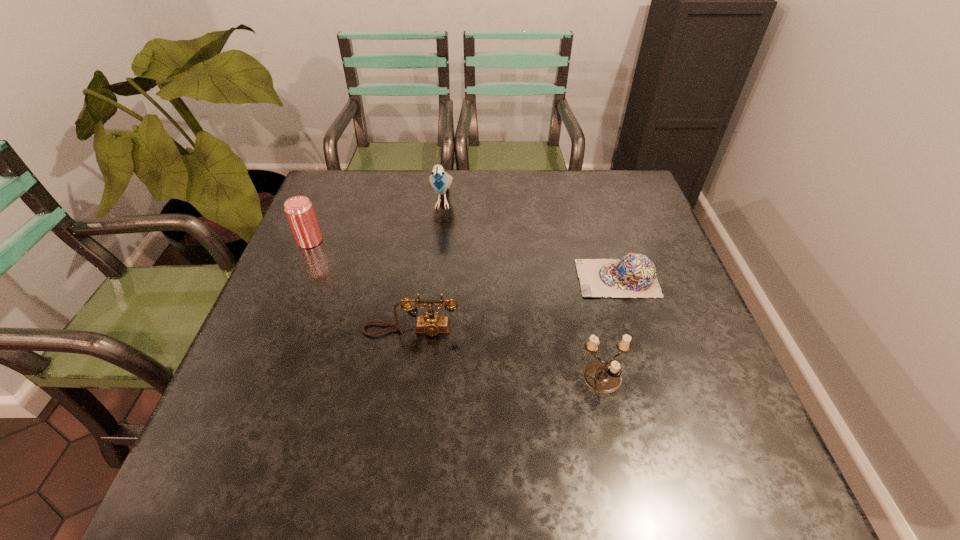
The width and height of the screenshot is (960, 540). In the image, there is a desktop. In order to click on vacant space at the left edge in this screenshot , I will do `click(265, 353)`.

Image resolution: width=960 pixels, height=540 pixels. In the image, there is a desktop. In order to click on blank space at the right edge in this screenshot , I will do `click(658, 346)`.

The image size is (960, 540). What are the coordinates of `free space at the far left corner` in the screenshot? It's located at (365, 190).

I want to click on vacant space at the far right corner of the desktop, so click(612, 183).

You are a GUI agent. You are given a task and a screenshot of the screen. Output one action in this format:
    pyautogui.click(x=<x>, y=<y>)
    Task: Click on the vacant area that lies between the candle holder and the telephone
    This screenshot has width=960, height=540.
    Given the screenshot: What is the action you would take?
    pyautogui.click(x=507, y=355)

Identify the location of free space that is in between the farthest object and the shortest object. This screenshot has height=540, width=960. (530, 239).

The image size is (960, 540). In order to click on free point between the second farthest object and the fourth farthest object in this screenshot , I will do `click(360, 285)`.

Where is `vacant space that is in between the cap and the bird`? The height and width of the screenshot is (540, 960). vacant space that is in between the cap and the bird is located at coordinates (530, 239).

At what (x,y) coordinates should I click in order to perform the action: click on blank region between the tallest object and the second nearest object. Please return your answer as a coordinate pair (x, y). Looking at the image, I should click on (427, 265).

The image size is (960, 540). Find the location of `free space that is in between the fourth farthest object and the nearest object`. free space that is in between the fourth farthest object and the nearest object is located at coordinates (507, 355).